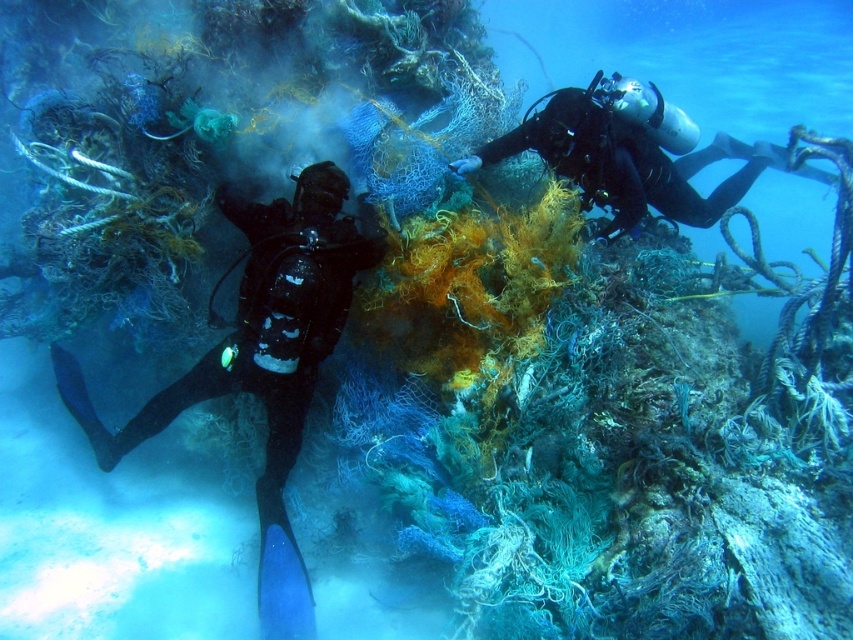
Which of these two, black matte scuba diver at left or black matte scuba diver at upper right, stands shorter?

With less height is black matte scuba diver at upper right.

This screenshot has height=640, width=853. Describe the element at coordinates (262, 362) in the screenshot. I see `black matte scuba diver at left` at that location.

Identify the location of black matte scuba diver at left. This screenshot has height=640, width=853. (262, 362).